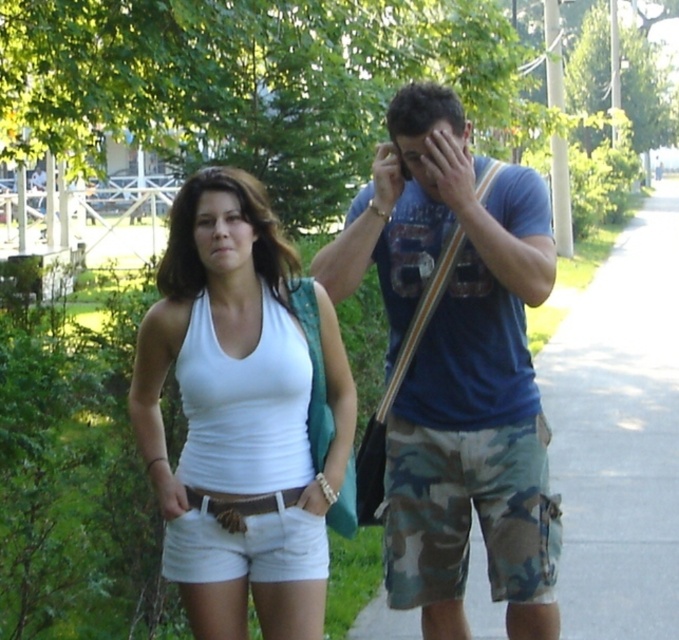
Consider the image. Is camo shorts at right above matte white tank top at center?

Actually, camo shorts at right is below matte white tank top at center.

Who is positioned more to the right, camo shorts at right or matte white tank top at center?

From the viewer's perspective, camo shorts at right appears more on the right side.

What do you see at coordinates (458, 380) in the screenshot?
I see `camo shorts at right` at bounding box center [458, 380].

Locate an element on the screen. camo shorts at right is located at coordinates (458, 380).

Does matte white tank top at center have a greater height compared to matte blue shirt at center?

Indeed, matte white tank top at center has a greater height compared to matte blue shirt at center.

Which of these two, matte white tank top at center or matte blue shirt at center, stands taller?

matte white tank top at center

Between point (215, 196) and point (460, 141), which one is positioned behind?

Positioned behind is point (460, 141).

Identify the location of matte white tank top at center. (221, 234).

Measure the distance between camo shorts at right and matte blue shirt at center.

A distance of 13.85 inches exists between camo shorts at right and matte blue shirt at center.

You are a GUI agent. You are given a task and a screenshot of the screen. Output one action in this format:
    pyautogui.click(x=<x>, y=<y>)
    Task: Click on the camo shorts at right
    This screenshot has height=640, width=679.
    Given the screenshot: What is the action you would take?
    pyautogui.click(x=458, y=380)

Which is behind, point (471, 275) or point (456, 168)?

The point (471, 275) is more distant.

Identify the location of camo shorts at right. [458, 380].